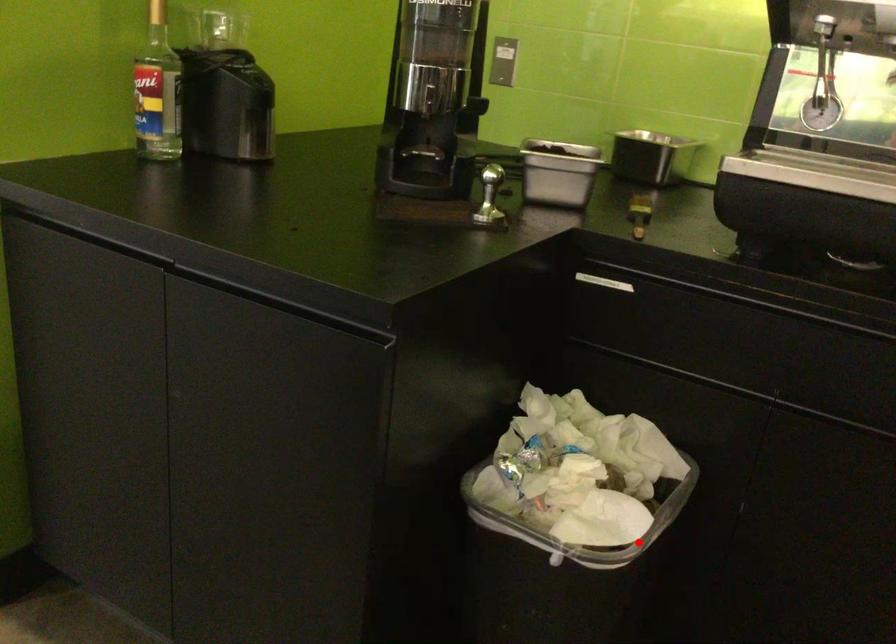
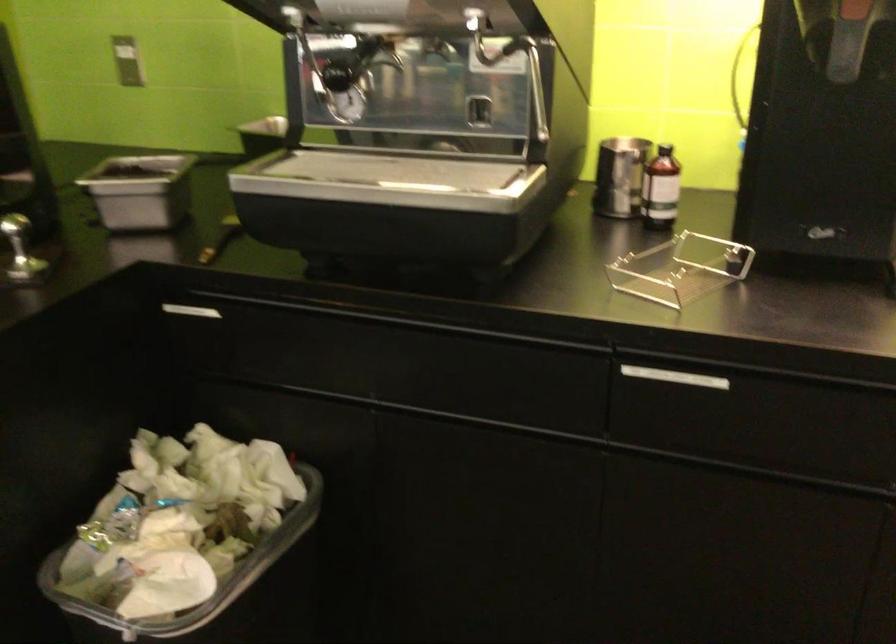
In the second image, find the point that corresponds to the highlighted location in the first image.

(218, 592)